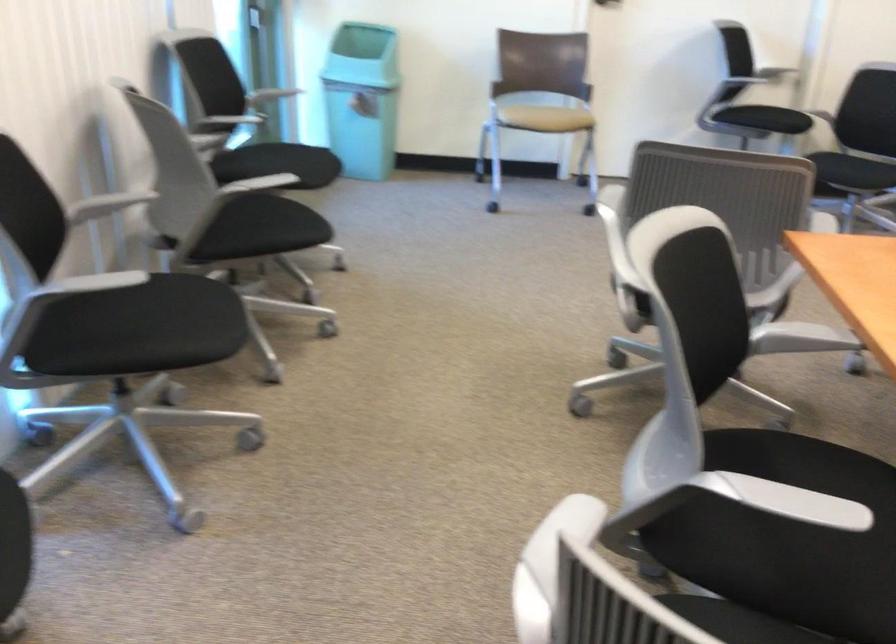
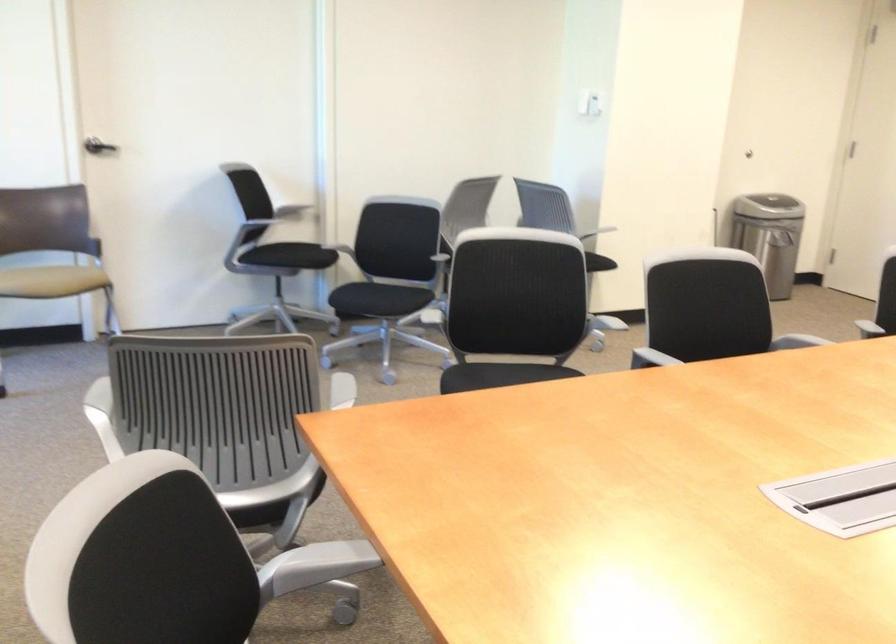
Where in the second image is the point corresponding to the point at 800,328 from the first image?

(320, 562)